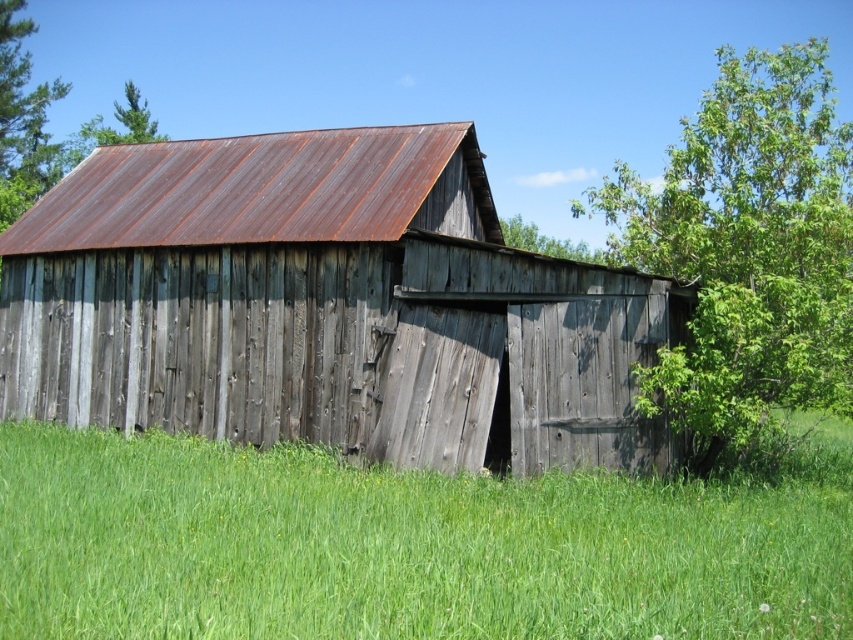
Is green grass at lower center to the left of green leafy tree at right from the viewer's perspective?

Correct, you'll find green grass at lower center to the left of green leafy tree at right.

Is green grass at lower center above green leafy tree at right?

No, green grass at lower center is not above green leafy tree at right.

Is point (590, 618) farther from camera compared to point (729, 138)?

That is False.

This screenshot has width=853, height=640. I want to click on green grass at lower center, so click(x=403, y=547).

Can you confirm if green grass at lower center is wider than green leafy tree at upper right?

Yes, green grass at lower center is wider than green leafy tree at upper right.

Which is more to the right, green grass at lower center or green leafy tree at upper right?

green leafy tree at upper right

Where is `green grass at lower center`? The image size is (853, 640). green grass at lower center is located at coordinates (403, 547).

Can you confirm if rusty metal shed at center is shorter than green leafy tree at upper left?

Indeed, rusty metal shed at center has a lesser height compared to green leafy tree at upper left.

Does rusty metal shed at center appear on the left side of green leafy tree at upper left?

No, rusty metal shed at center is not to the left of green leafy tree at upper left.

Who is more forward, (630, 321) or (117, 141)?

Point (630, 321)

Find the location of a particular element. The width and height of the screenshot is (853, 640). rusty metal shed at center is located at coordinates (323, 307).